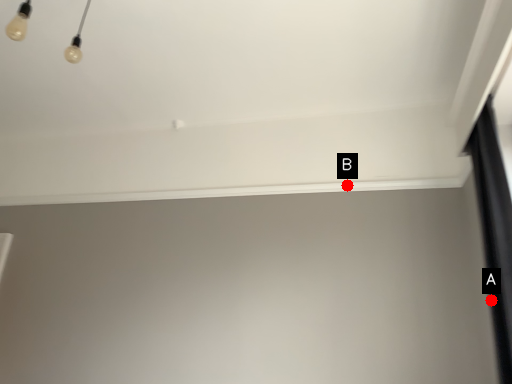
Question: Two points are circled on the image, labeled by A and B beside each circle. Which point is further to the camera?

Choices:
 (A) A is further
 (B) B is further

Answer: (B)